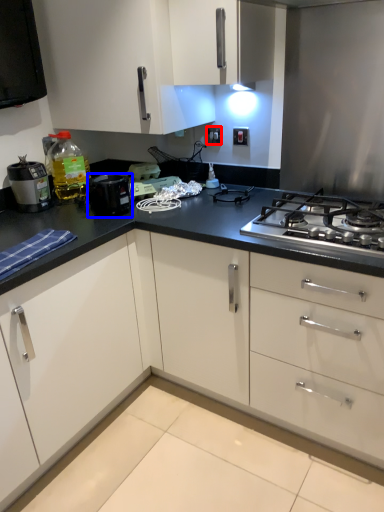
Question: Among these objects, which one is farthest to the camera, electric outlet (highlighted by a red box) or kitchen appliance (highlighted by a blue box)?

Choices:
 (A) electric outlet
 (B) kitchen appliance

Answer: (A)